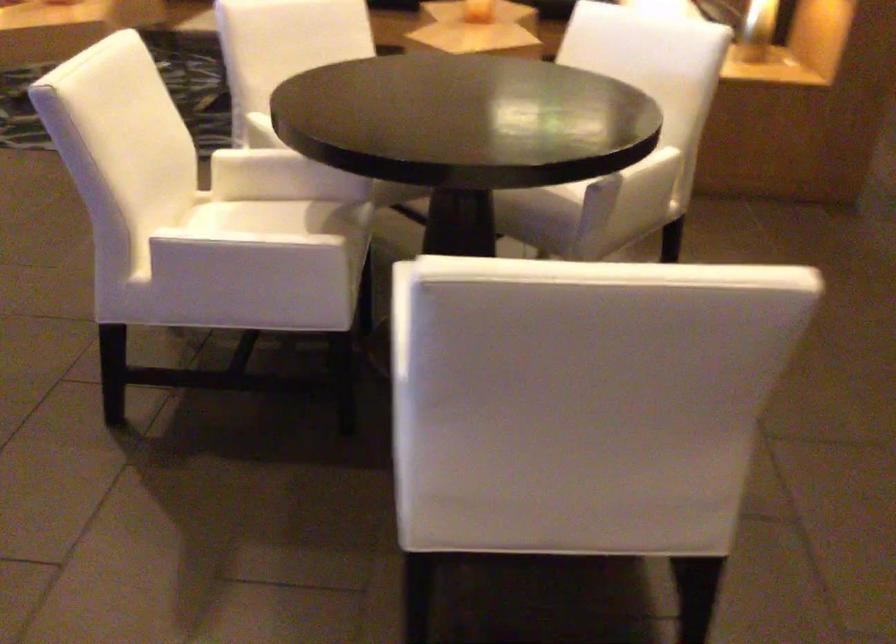
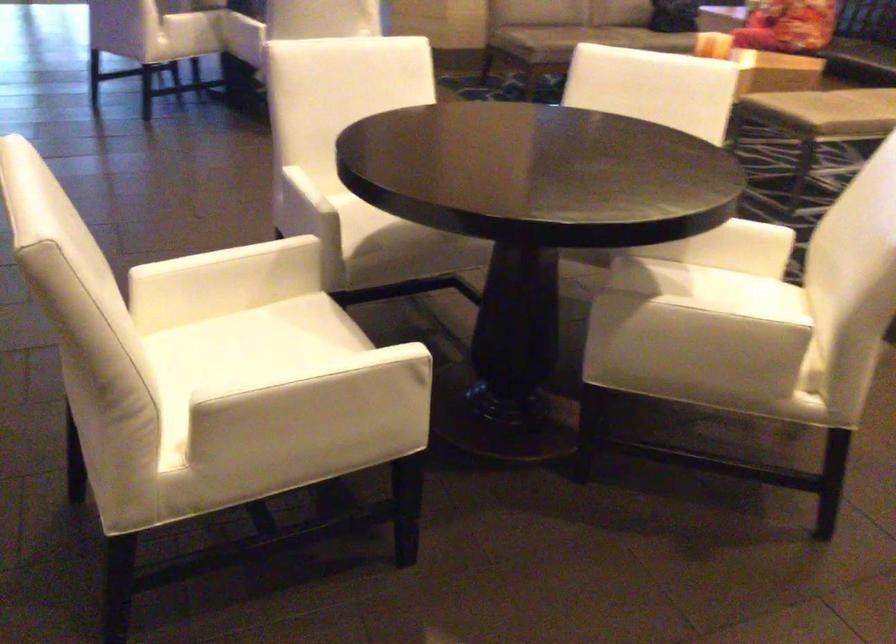
In the second image, find the point that corresponds to point (294, 247) in the first image.

(372, 223)